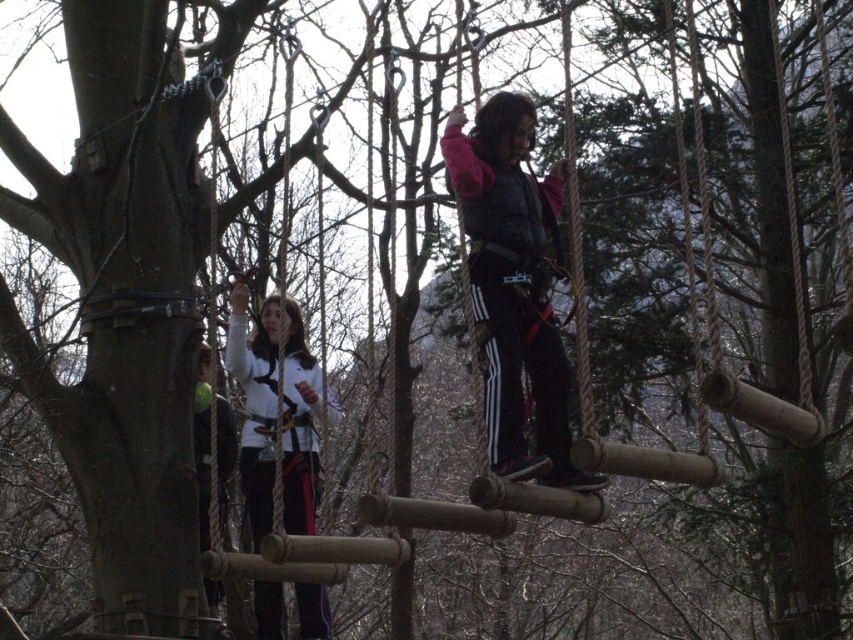
Can you confirm if white matte jacket at center is positioned to the left of white fabric jacket at center?

In fact, white matte jacket at center is to the right of white fabric jacket at center.

Can you confirm if white matte jacket at center is bigger than white fabric jacket at center?

Yes.

Identify the location of white matte jacket at center. The width and height of the screenshot is (853, 640). (276, 412).

This screenshot has height=640, width=853. I want to click on white matte jacket at center, so click(276, 412).

Which is more to the left, black matte pants at center or white fabric jacket at center?

Positioned to the left is white fabric jacket at center.

Does point (532, 264) come closer to viewer compared to point (206, 588)?

Yes, point (532, 264) is in front of point (206, 588).

Is point (450, 161) less distant than point (224, 481)?

Yes, point (450, 161) is in front of point (224, 481).

Where is `black matte pants at center`? This screenshot has height=640, width=853. black matte pants at center is located at coordinates (514, 288).

The image size is (853, 640). What do you see at coordinates (514, 288) in the screenshot? I see `black matte pants at center` at bounding box center [514, 288].

Can you confirm if black matte pants at center is positioned above white matte jacket at center?

Answer: Indeed, black matte pants at center is positioned over white matte jacket at center.

Describe the element at coordinates (514, 288) in the screenshot. I see `black matte pants at center` at that location.

Locate an element on the screen. Image resolution: width=853 pixels, height=640 pixels. black matte pants at center is located at coordinates (514, 288).